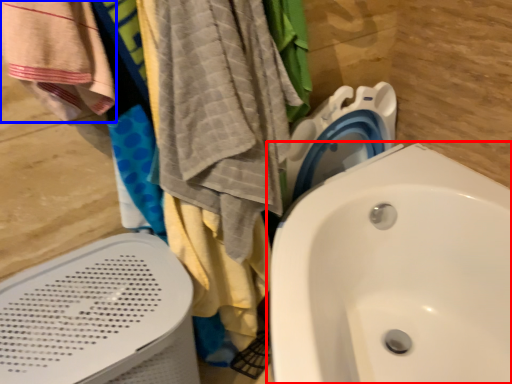
Question: Which of the following is the closest to the observer, sink (highlighted by a red box) or beach towel (highlighted by a blue box)?

Choices:
 (A) sink
 (B) beach towel

Answer: (A)